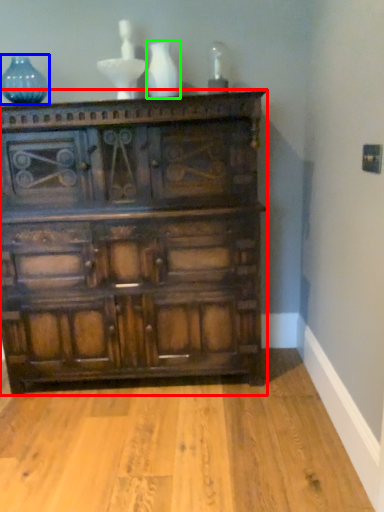
Question: Which object is the farthest from chest of drawers (highlighted by a red box)? Choose among these: glass vase (highlighted by a blue box) or vase (highlighted by a green box).

Choices:
 (A) glass vase
 (B) vase

Answer: (A)